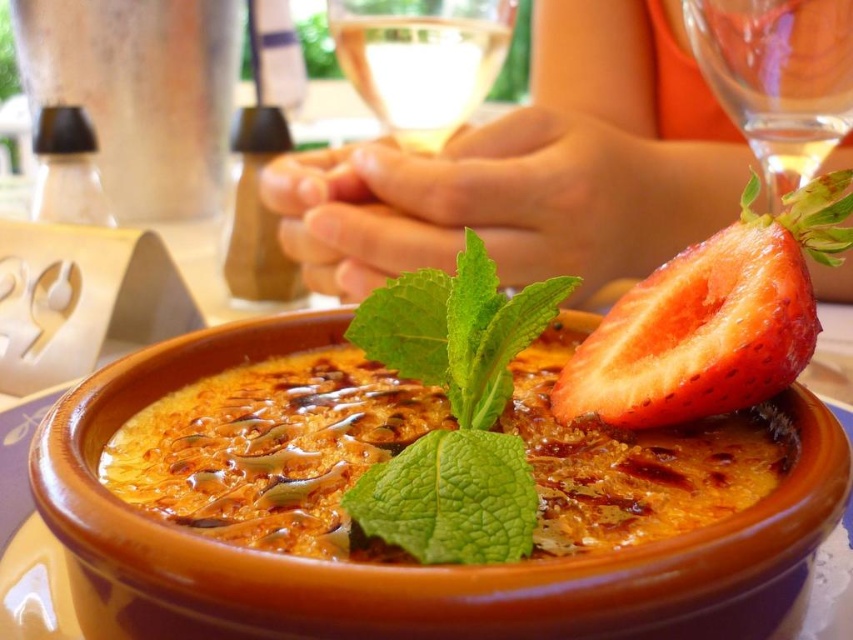
Question: Among these points, which one is farthest from the camera?

Choices:
 (A) (334, 42)
 (B) (73, 524)
 (C) (479, 472)
 (D) (791, 252)

Answer: (A)

Question: Among these objects, which one is nearest to the camera?

Choices:
 (A) transparent glass at upper right
 (B) transparent glass at upper center

Answer: (A)

Question: Is the position of transparent glass at upper right more distant than that of transparent glass at upper center?

Choices:
 (A) yes
 (B) no

Answer: (B)

Question: Is transparent glass at upper right closer to the viewer compared to transparent glass at upper center?

Choices:
 (A) no
 (B) yes

Answer: (B)

Question: Which of these objects is positioned closest to the green leafy mint at center?

Choices:
 (A) transparent glass at upper right
 (B) red matte strawberry at upper right
 (C) transparent glass at upper center

Answer: (B)

Question: Is red matte strawberry at upper right in front of transparent glass at upper right?

Choices:
 (A) no
 (B) yes

Answer: (B)